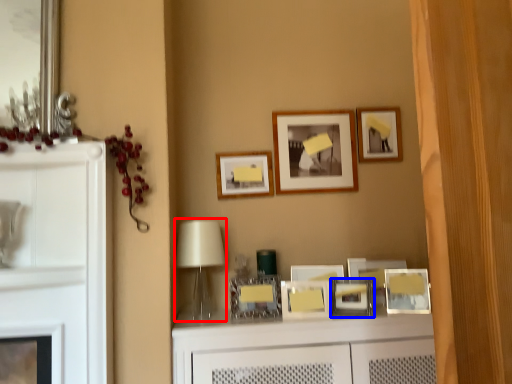
Question: Which object appears closest to the camera in this image, table lamp (highlighted by a red box) or picture frame (highlighted by a blue box)?

Choices:
 (A) table lamp
 (B) picture frame

Answer: (A)